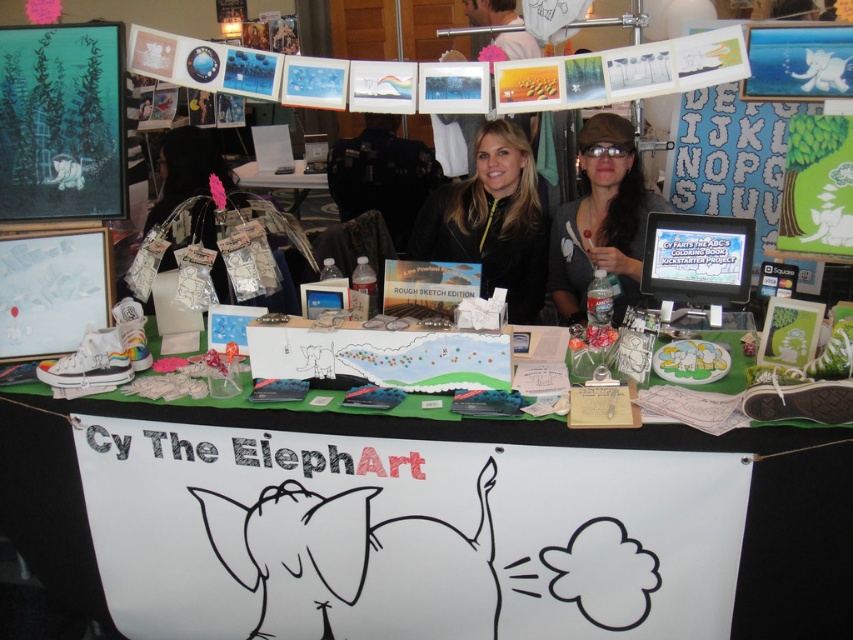
Question: Among these points, which one is nearest to the camera?

Choices:
 (A) (335, 432)
 (B) (172, 131)
 (C) (675, 221)
 (D) (538, 301)

Answer: (A)

Question: Where is white paper banner at center located in relation to matte white paper at center in the image?

Choices:
 (A) right
 (B) left

Answer: (A)

Question: Is matte white paper at center smaller than matte plastic table at center?

Choices:
 (A) yes
 (B) no

Answer: (A)

Question: Which point is farther from the camera taking this photo?

Choices:
 (A) (624, 221)
 (B) (206, 154)

Answer: (B)

Question: Does white paper banner at center have a smaller size compared to matte white paper at center?

Choices:
 (A) no
 (B) yes

Answer: (A)

Question: Which object is positioned closest to the teal matte painting at upper left?

Choices:
 (A) matte black cap at center
 (B) matte white paper at center
 (C) matte plastic table at center
 (D) matte black jacket at center

Answer: (B)